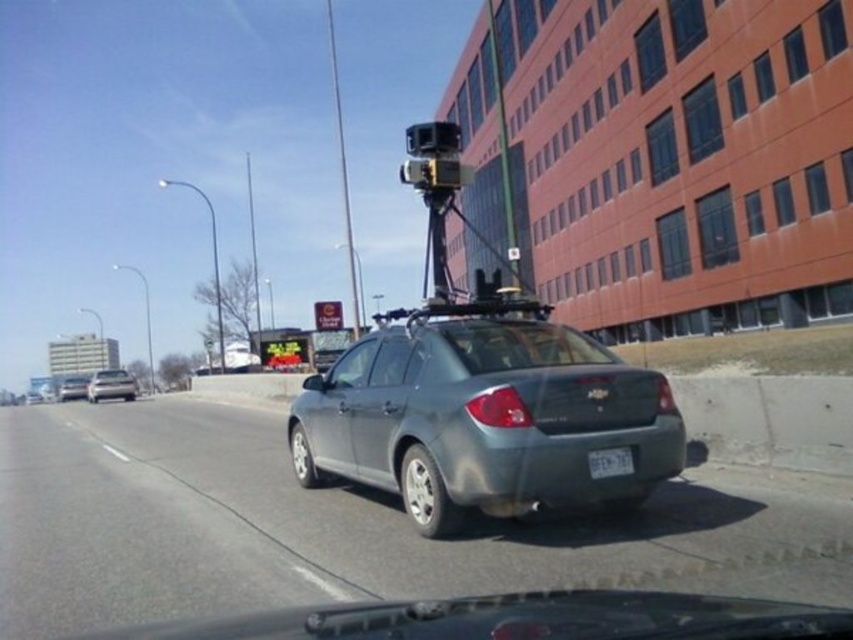
Question: Which of the following is the farthest from the observer?

Choices:
 (A) (106, 374)
 (B) (590, 465)

Answer: (A)

Question: Which object is the farthest from the satin gray sedan at center?

Choices:
 (A) white plastic license plate at center
 (B) satin silver sedan at left

Answer: (B)

Question: Among these objects, which one is nearest to the camera?

Choices:
 (A) satin silver sedan at center
 (B) satin silver sedan at left
 (C) satin gray sedan at center
 (D) white plastic license plate at center

Answer: (C)

Question: Does satin gray sedan at center have a lesser width compared to satin silver sedan at center?

Choices:
 (A) yes
 (B) no

Answer: (A)

Question: Is white plastic license plate at center wider than satin silver sedan at center?

Choices:
 (A) no
 (B) yes

Answer: (A)

Question: Is satin silver sedan at left bigger than satin silver sedan at center?

Choices:
 (A) no
 (B) yes

Answer: (A)